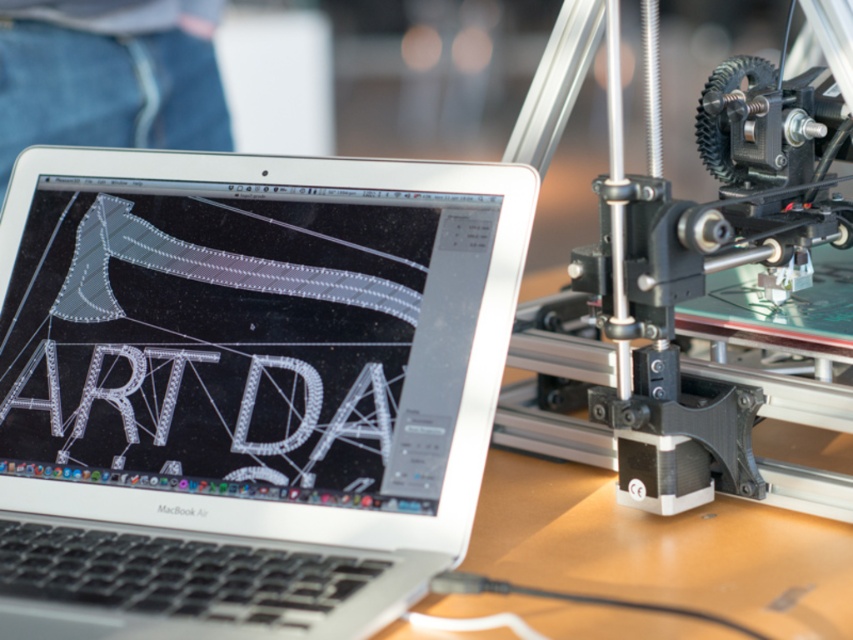
What is located at the coordinates point (244, 387)?

The silver black laptop at center is located at point (244, 387).

You are a delivery person who needs to place a small package on the workspace shown in the image. The package must be placed at a distance of exactly 27.07 inches from you. Can you place the package at the point marked as point (387, 518)?

Yes, the point marked as point (387, 518) is exactly 27.07 inches away from you, so you can place the package there.